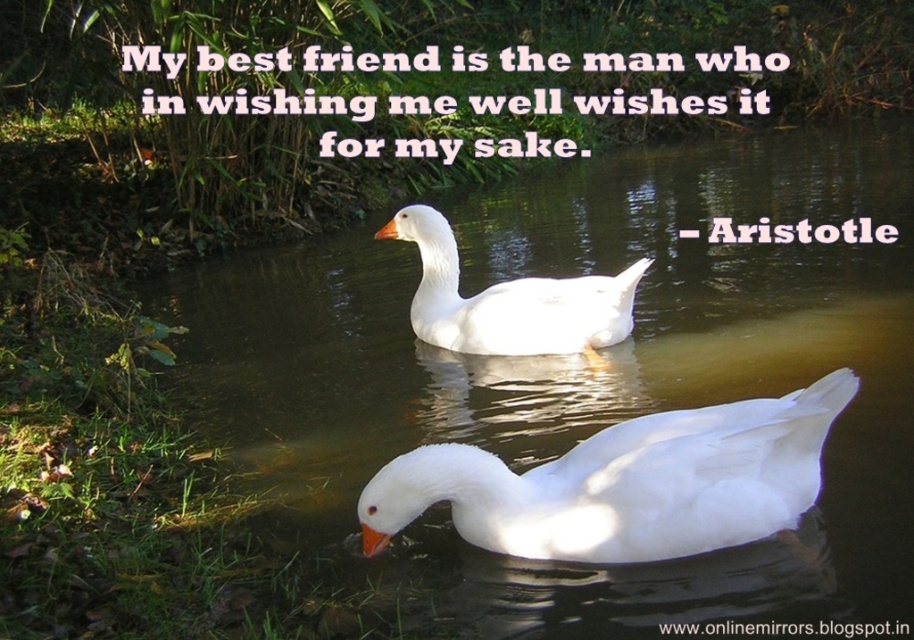
Can you confirm if clear water at center is positioned above white matte swan at lower center?

Indeed, clear water at center is positioned over white matte swan at lower center.

Measure the distance from clear water at center to white matte swan at lower center.

A distance of 5.37 feet exists between clear water at center and white matte swan at lower center.

Is point (742, 388) in front of point (572, 538)?

No, (742, 388) is behind (572, 538).

The image size is (914, 640). In order to click on clear water at center in this screenshot , I will do point(578,380).

Is white matte swan at lower center closer to the viewer compared to white matte duck at center?

Yes.

Is white matte swan at lower center further to the viewer compared to white matte duck at center?

No, white matte swan at lower center is closer to the viewer.

Where is `white matte swan at lower center`? This screenshot has width=914, height=640. white matte swan at lower center is located at coordinates (626, 483).

Where is `white matte swan at lower center`? The width and height of the screenshot is (914, 640). white matte swan at lower center is located at coordinates (626, 483).

Is clear water at center above white matte duck at center?

Correct, clear water at center is located above white matte duck at center.

Between point (303, 298) and point (522, 332), which one is positioned in front?

Point (522, 332) is more forward.

Find the location of `clear water at center`. clear water at center is located at coordinates point(578,380).